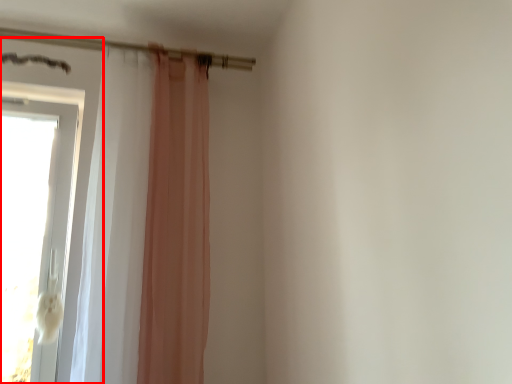
Question: From the image's perspective, where is door (annotated by the red box) located relative to shower curtain?

Choices:
 (A) below
 (B) above

Answer: (A)